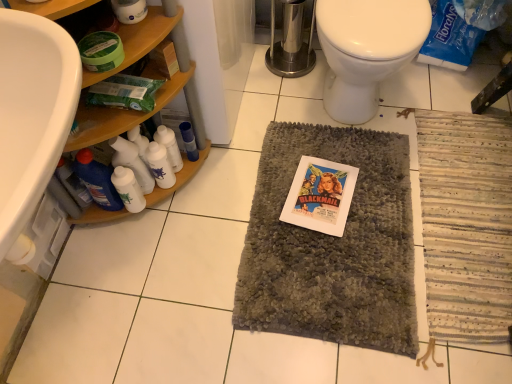
Locate an element on the screen. This screenshot has height=384, width=512. free space in front of woodenshelves at left is located at coordinates (141, 281).